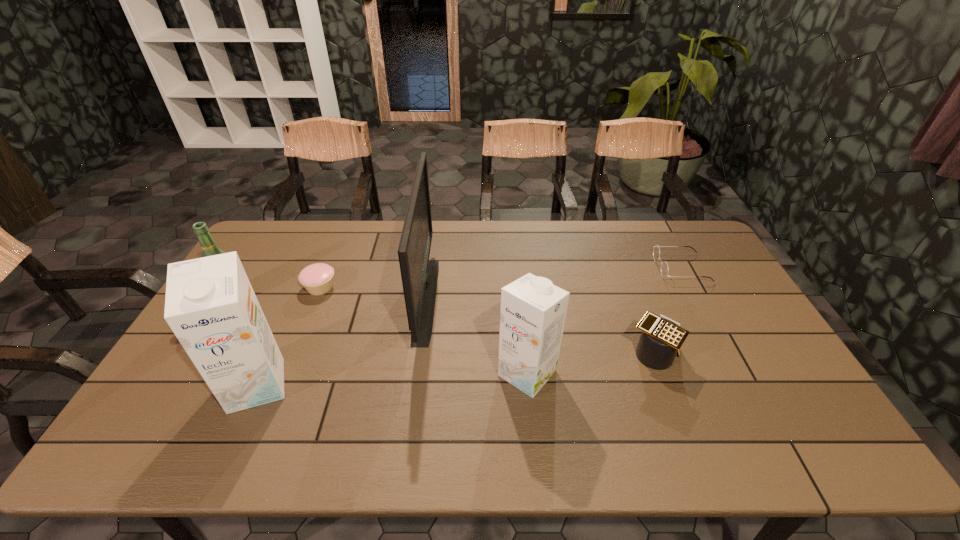
At what (x,y) coordinates should I click in order to perform the action: click on free region located on the back of the left carton. Please return your answer as a coordinate pair (x, y). The width and height of the screenshot is (960, 540). Looking at the image, I should click on click(x=297, y=296).

Identify the location of free spot located on the right of the right carton. The height and width of the screenshot is (540, 960). (696, 373).

The height and width of the screenshot is (540, 960). I want to click on vacant space situated on the front-facing side of the spectacles, so click(x=607, y=268).

At what (x,y) coordinates should I click in order to perform the action: click on free location located on the front-facing side of the spectacles. Please return your answer as a coordinate pair (x, y). This screenshot has width=960, height=540. Looking at the image, I should click on [x=607, y=268].

You are a GUI agent. You are given a task and a screenshot of the screen. Output one action in this format:
    pyautogui.click(x=<x>, y=<y>)
    Task: Click on the free point located 0.250m on the front-facing side of the spectacles
    
    Given the screenshot: What is the action you would take?
    pyautogui.click(x=583, y=268)

The height and width of the screenshot is (540, 960). What are the coordinates of `free space located on the right of the fifth tallest object` in the screenshot? It's located at (698, 354).

Identify the location of vacant space located on the front-facing side of the fourth object from right to left. Image resolution: width=960 pixels, height=540 pixels. (470, 299).

Locate an element on the screen. This screenshot has width=960, height=540. vacant space situated on the surface of the beer bottle is located at coordinates (197, 360).

Find the location of a particular element. This screenshot has height=540, width=960. vacant space located 0.400m on the front of the cupcake is located at coordinates (270, 411).

Image resolution: width=960 pixels, height=540 pixels. What are the coordinates of `spectacles situated at the far edge` in the screenshot? It's located at (664, 269).